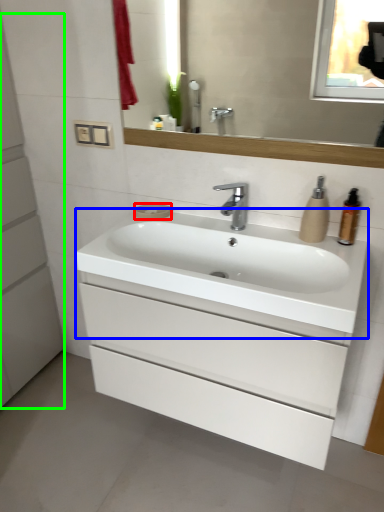
Question: Which object is the farthest from soap (highlighted by a red box)? Choose among these: counter top (highlighted by a blue box) or screen door (highlighted by a green box).

Choices:
 (A) counter top
 (B) screen door

Answer: (B)